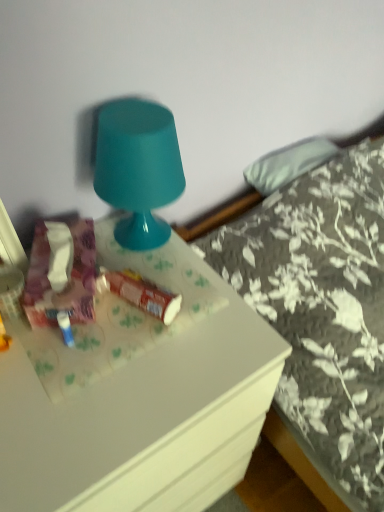
Locate an element on the screen. vacant space in front of glossy plastic lamp at upper center is located at coordinates click(x=167, y=288).